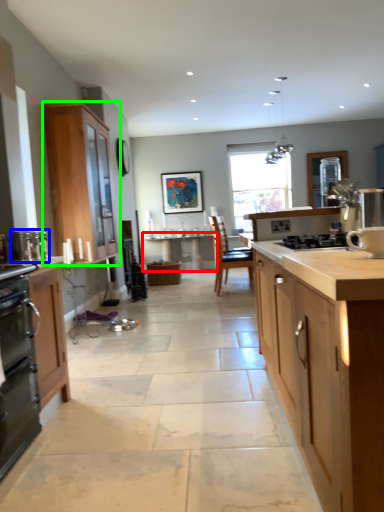
Question: Which is nearer to the table (highlighted by a red box)? appliance (highlighted by a blue box) or cabinetry (highlighted by a green box).

Choices:
 (A) appliance
 (B) cabinetry

Answer: (B)